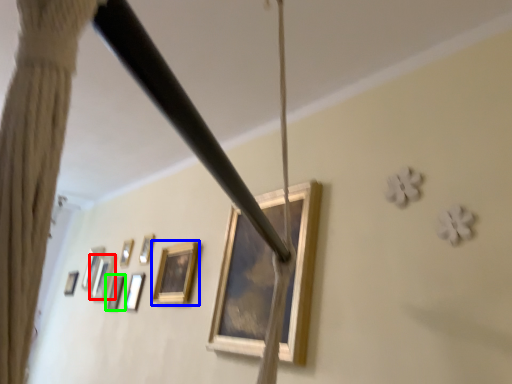
Question: Which is farther away from picture frame (highlighted by a red box)? picture frame (highlighted by a blue box) or picture frame (highlighted by a green box)?

Choices:
 (A) picture frame
 (B) picture frame

Answer: (A)